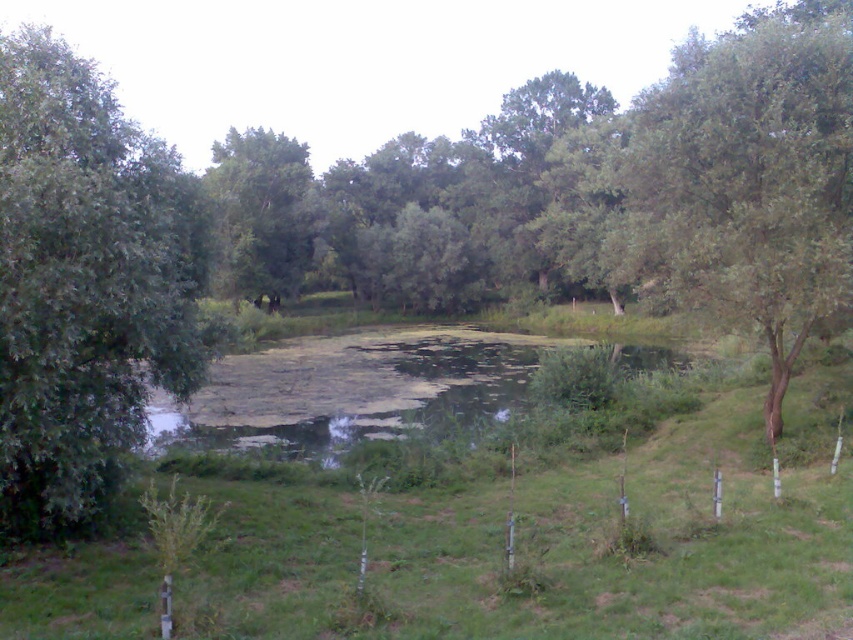
You are a gardener planning to plant a new tree in the area between the green leafy tree at left and the green leafy tree at center. Considering their sizes, which existing tree should you use as a reference for spacing to ensure the new tree has enough room to grow?

The green leafy tree at center is larger, so you should use it as a reference for spacing to ensure the new tree has enough room to grow.

You are planning to plant a new tree in this area. Considering the spacing between the green leafy tree at left and the green leafy tree at center, which existing tree should you use as a reference for spacing to ensure adequate growth space for the new tree?

The green leafy tree at center is wider than the green leafy tree at left, so you should use the green leafy tree at center as a reference for spacing to ensure the new tree has enough space to grow properly.

You are standing in the grassy area near the pond and want to take a photo of both the green leafy tree at left and the green leafy tree at center. Which tree should you position closer to the camera to include both in the frame without cropping?

You should position the green leafy tree at left closer to the camera because it is shorter than the green leafy tree at center, allowing both to fit in the frame without cropping.